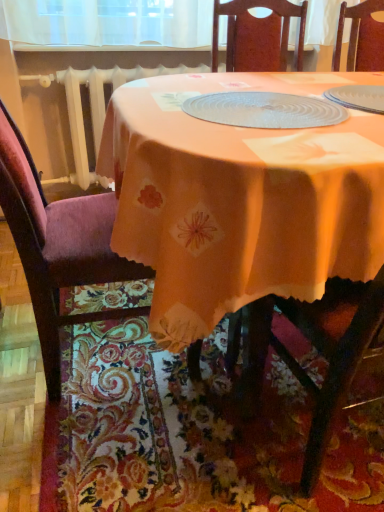
Question: Is velvet purple chair at left turned away from clear plastic placemat at center?

Choices:
 (A) yes
 (B) no

Answer: (B)

Question: Is velvet purple chair at left behind clear plastic placemat at center?

Choices:
 (A) no
 (B) yes

Answer: (A)

Question: Would you consider velvet purple chair at left to be distant from clear plastic placemat at center?

Choices:
 (A) no
 (B) yes

Answer: (A)

Question: Considering the relative positions of velvet purple chair at left and clear plastic placemat at center in the image provided, is velvet purple chair at left in front of clear plastic placemat at center?

Choices:
 (A) yes
 (B) no

Answer: (A)

Question: Considering the relative sizes of velvet purple chair at left and clear plastic placemat at center in the image provided, is velvet purple chair at left shorter than clear plastic placemat at center?

Choices:
 (A) no
 (B) yes

Answer: (A)

Question: Is velvet purple chair at left aimed at clear plastic placemat at center?

Choices:
 (A) yes
 (B) no

Answer: (A)

Question: Considering the relative sizes of orange fabric table at center and velvet purple chair at left in the image provided, is orange fabric table at center shorter than velvet purple chair at left?

Choices:
 (A) no
 (B) yes

Answer: (B)

Question: Is velvet purple chair at left a part of orange fabric table at center?

Choices:
 (A) yes
 (B) no

Answer: (A)

Question: Considering the relative positions of orange fabric table at center and velvet purple chair at left in the image provided, is orange fabric table at center in front of velvet purple chair at left?

Choices:
 (A) no
 (B) yes

Answer: (B)

Question: Considering the relative sizes of orange fabric table at center and velvet purple chair at left in the image provided, is orange fabric table at center taller than velvet purple chair at left?

Choices:
 (A) no
 (B) yes

Answer: (A)

Question: Is orange fabric table at center at the right side of velvet purple chair at left?

Choices:
 (A) no
 (B) yes

Answer: (B)

Question: Can you see orange fabric table at center touching velvet purple chair at left?

Choices:
 (A) yes
 (B) no

Answer: (B)

Question: Can you confirm if velvet purple chair at left is smaller than orange fabric table at center?

Choices:
 (A) yes
 (B) no

Answer: (A)